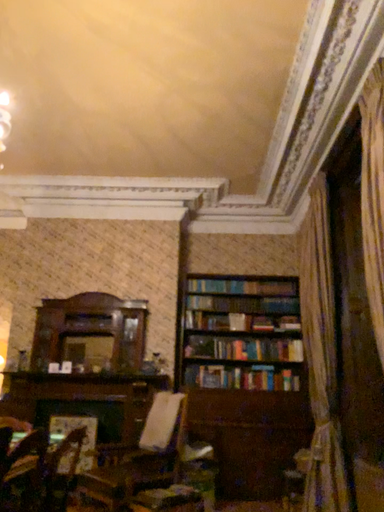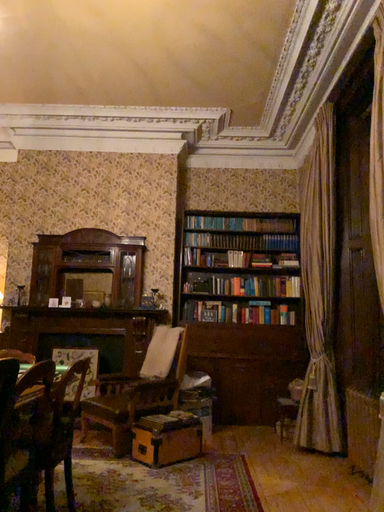
Question: Which way did the camera rotate in the video?

Choices:
 (A) rotated upward
 (B) rotated downward

Answer: (B)